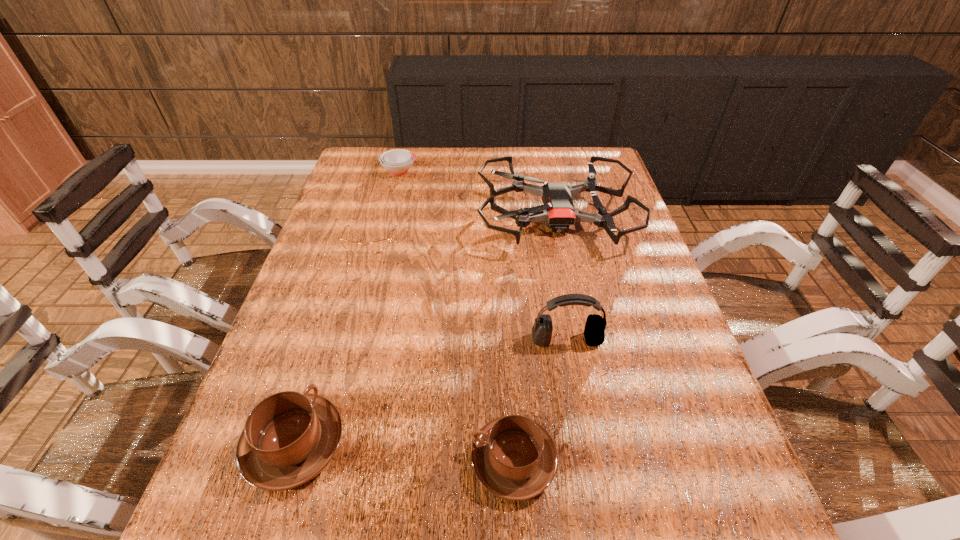
I want to click on vacant space at the far edge, so click(x=490, y=164).

Where is `vacant space at the near edge`? vacant space at the near edge is located at coordinates (355, 459).

You are a GUI agent. You are given a task and a screenshot of the screen. Output one action in this format:
    pyautogui.click(x=<x>, y=<y>)
    Task: Click on the vacant space at the left edge
    
    Given the screenshot: What is the action you would take?
    pyautogui.click(x=352, y=200)

I want to click on free location at the right edge of the desktop, so click(x=609, y=202).

The width and height of the screenshot is (960, 540). I want to click on vacant space at the far left corner of the desktop, so click(x=386, y=178).

Where is `vacant area between the second shortest object and the left cappuccino`? vacant area between the second shortest object and the left cappuccino is located at coordinates (348, 308).

This screenshot has height=540, width=960. What are the coordinates of `vacant space that is in between the shorter cappuccino and the fourth farthest object` in the screenshot? It's located at (540, 400).

Image resolution: width=960 pixels, height=540 pixels. In order to click on vacant area between the right cappuccino and the taller cappuccino in this screenshot , I will do [x=404, y=453].

Where is `free area in between the farthest object and the taller cappuccino`? The image size is (960, 540). free area in between the farthest object and the taller cappuccino is located at coordinates (348, 308).

You are a GUI agent. You are given a task and a screenshot of the screen. Output one action in this format:
    pyautogui.click(x=<x>, y=<y>)
    Task: Click on the empty space that is in between the farthest object and the spectacles
    The width and height of the screenshot is (960, 540).
    Given the screenshot: What is the action you would take?
    pyautogui.click(x=385, y=206)